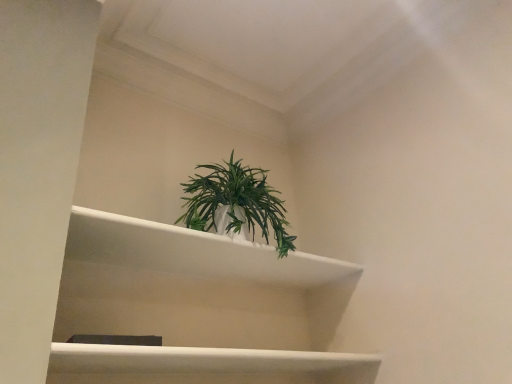
Question: From the image's perspective, is white glossy shelf at center positioned above or below green matte plant at center?

Choices:
 (A) below
 (B) above

Answer: (A)

Question: Looking at the image, does white glossy shelf at center seem bigger or smaller compared to green matte plant at center?

Choices:
 (A) big
 (B) small

Answer: (A)

Question: Would you say white glossy shelf at center is to the left or to the right of green matte plant at center in the picture?

Choices:
 (A) right
 (B) left

Answer: (B)

Question: Is point (201, 225) closer or farther from the camera than point (283, 377)?

Choices:
 (A) closer
 (B) farther

Answer: (B)

Question: Based on their positions, is green matte plant at center located to the left or right of white glossy shelf at center?

Choices:
 (A) left
 (B) right

Answer: (B)

Question: From a real-world perspective, is green matte plant at center above or below white glossy shelf at center?

Choices:
 (A) above
 (B) below

Answer: (A)

Question: From the image's perspective, is green matte plant at center located above or below white glossy shelf at center?

Choices:
 (A) below
 (B) above

Answer: (B)